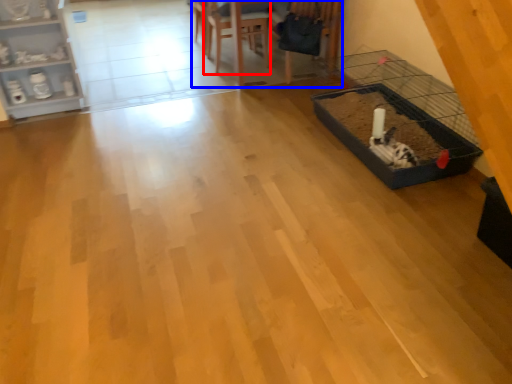
Question: Which object is further to the camera taking this photo, armchair (highlighted by a red box) or table (highlighted by a blue box)?

Choices:
 (A) armchair
 (B) table

Answer: (A)